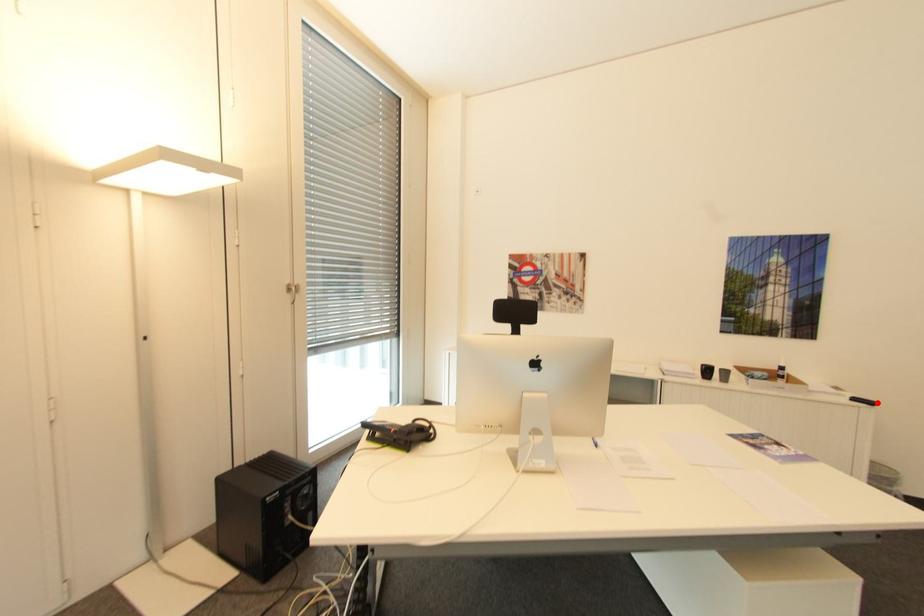
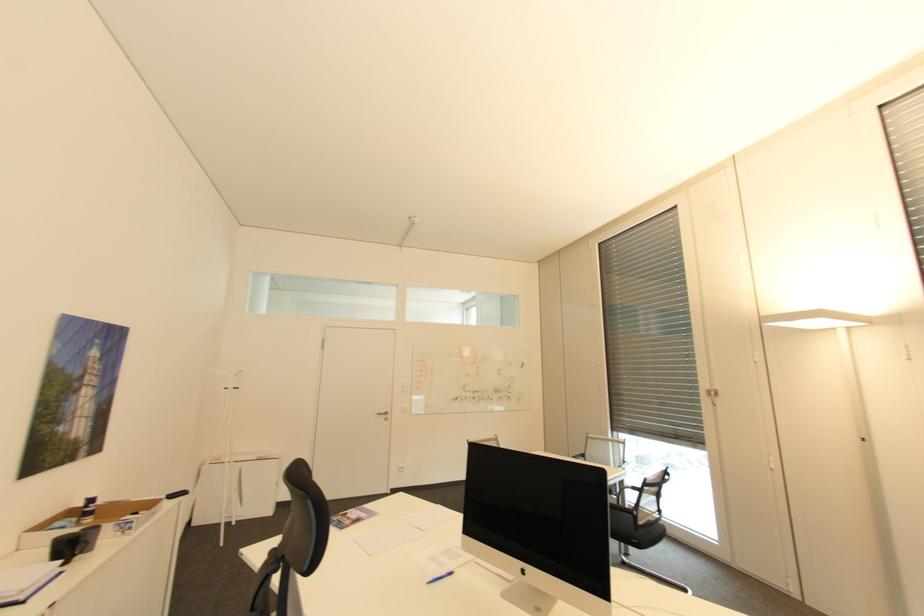
Where in the second image is the point corresponding to the highlighted location from the first image?

(188, 493)